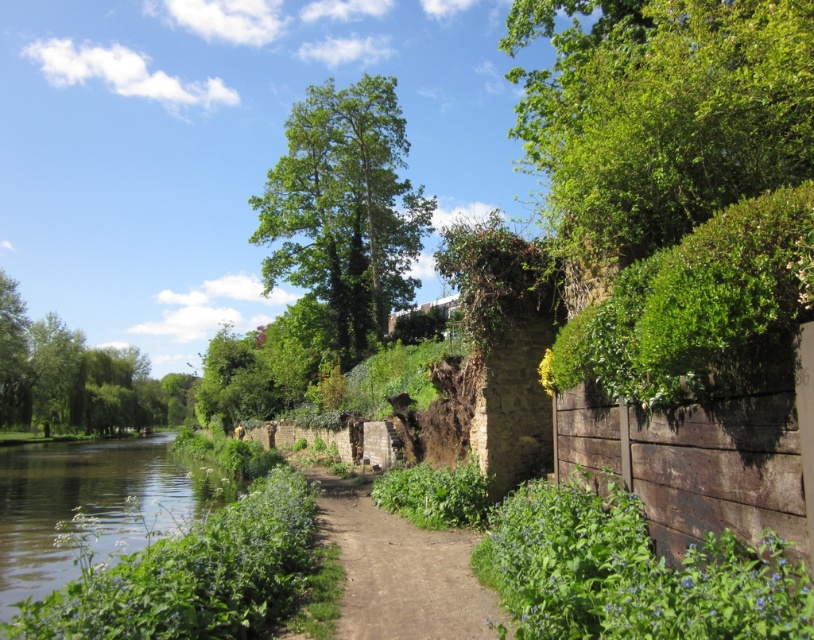
Question: Which object is positioned farthest from the green leafy tree at center?

Choices:
 (A) green leafy hedge at upper right
 (B) green grassy river at lower left
 (C) green leafy tree at upper right
 (D) dirt path at center

Answer: (A)

Question: Which object appears closest to the camera in this image?

Choices:
 (A) green grassy river at lower left
 (B) green leafy tree at left

Answer: (A)

Question: Does green leafy tree at center come in front of green leafy tree at left?

Choices:
 (A) no
 (B) yes

Answer: (B)

Question: Does green leafy tree at center have a lesser width compared to green leafy tree at left?

Choices:
 (A) no
 (B) yes

Answer: (B)

Question: Which of the following is the closest to the observer?

Choices:
 (A) green grassy river at lower left
 (B) green leafy tree at center

Answer: (A)

Question: Can you confirm if green leafy hedge at upper right is positioned to the right of dirt path at center?

Choices:
 (A) yes
 (B) no

Answer: (A)